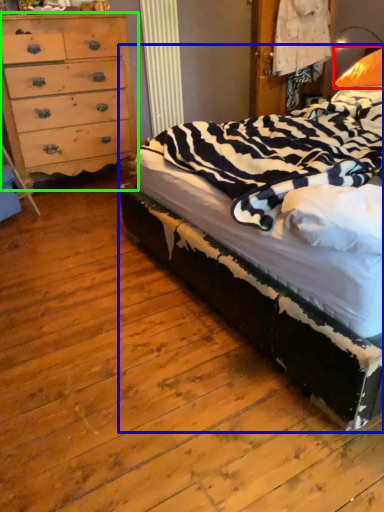
Question: Based on their relative distances, which object is nearer to pillow (highlighted by a red box)? Choose from bed (highlighted by a blue box) and chest of drawers (highlighted by a green box).

Choices:
 (A) bed
 (B) chest of drawers

Answer: (A)